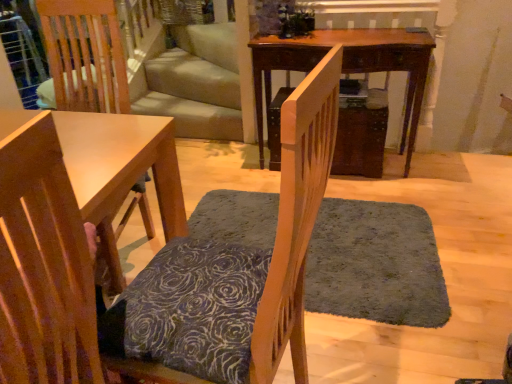
Identify the location of vacant location behind dark gray shaggy rug at center. (332, 181).